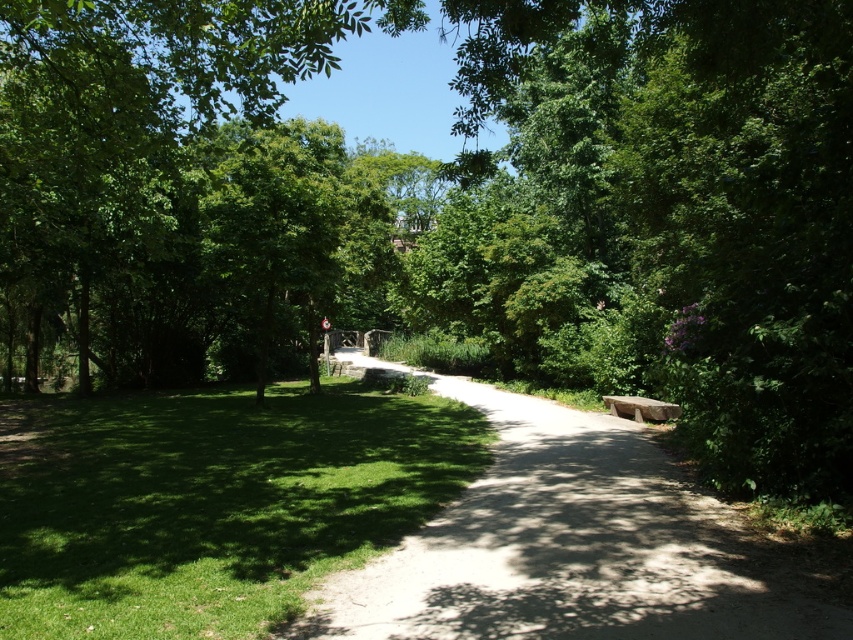
Question: Is green grass at center bigger than dirt path at center?

Choices:
 (A) no
 (B) yes

Answer: (B)

Question: Which object appears closest to the camera in this image?

Choices:
 (A) dirt path at center
 (B) green grass at center

Answer: (A)

Question: Which of the following is the farthest from the observer?

Choices:
 (A) gray stone bench at right
 (B) green grass at center

Answer: (A)

Question: Considering the real-world distances, which object is closest to the gray stone bench at right?

Choices:
 (A) green grass at center
 (B) dirt path at center

Answer: (B)

Question: Is dirt path at center above gray stone bench at right?

Choices:
 (A) yes
 (B) no

Answer: (B)

Question: Is green grass at center to the right of gray stone bench at right from the viewer's perspective?

Choices:
 (A) no
 (B) yes

Answer: (A)